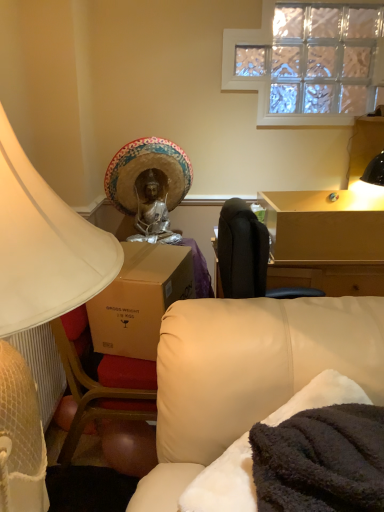
Question: Is light brown wooden table at upper right shorter than white matte lampshade at left?

Choices:
 (A) no
 (B) yes

Answer: (B)

Question: Is light brown wooden table at upper right facing away from white matte lampshade at left?

Choices:
 (A) yes
 (B) no

Answer: (B)

Question: Does light brown wooden table at upper right have a smaller size compared to white matte lampshade at left?

Choices:
 (A) no
 (B) yes

Answer: (B)

Question: From a real-world perspective, is light brown wooden table at upper right on white matte lampshade at left?

Choices:
 (A) yes
 (B) no

Answer: (A)

Question: Can you confirm if light brown wooden table at upper right is positioned to the left of white matte lampshade at left?

Choices:
 (A) yes
 (B) no

Answer: (B)

Question: Does light brown wooden table at upper right lie in front of white matte lampshade at left?

Choices:
 (A) no
 (B) yes

Answer: (A)

Question: Is white matte lampshade at left closer to the viewer compared to light brown wooden table at upper right?

Choices:
 (A) yes
 (B) no

Answer: (A)

Question: From the image's perspective, does white matte lampshade at left appear higher than light brown wooden table at upper right?

Choices:
 (A) yes
 (B) no

Answer: (B)

Question: Considering the relative sizes of white matte lampshade at left and light brown wooden table at upper right in the image provided, is white matte lampshade at left shorter than light brown wooden table at upper right?

Choices:
 (A) no
 (B) yes

Answer: (A)

Question: From the image's perspective, would you say white matte lampshade at left is shown under light brown wooden table at upper right?

Choices:
 (A) no
 (B) yes

Answer: (B)

Question: Considering the relative sizes of white matte lampshade at left and light brown wooden table at upper right in the image provided, is white matte lampshade at left smaller than light brown wooden table at upper right?

Choices:
 (A) no
 (B) yes

Answer: (A)

Question: Can you confirm if white matte lampshade at left is taller than light brown wooden table at upper right?

Choices:
 (A) no
 (B) yes

Answer: (B)

Question: From a real-world perspective, does straw hat at upper center sit lower than white matte lampshade at left?

Choices:
 (A) yes
 (B) no

Answer: (B)